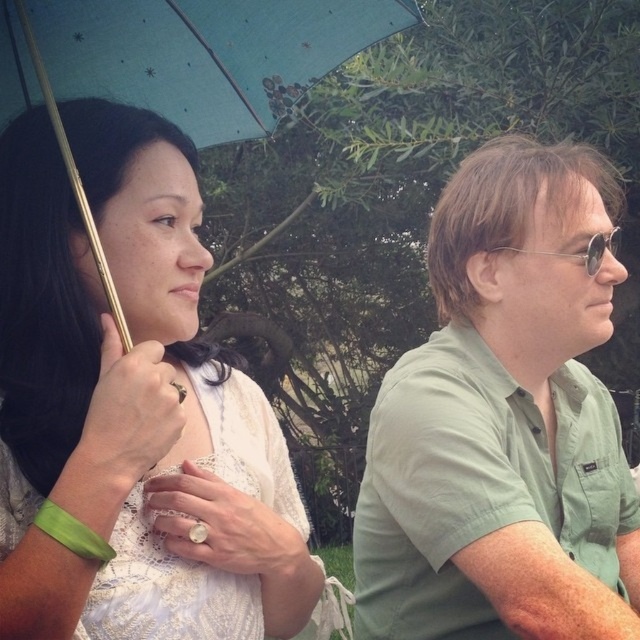
Question: Which object is farther from the camera taking this photo?

Choices:
 (A) green cotton shirt at right
 (B) blue fabric umbrella at upper left
 (C) white lace dress at upper left

Answer: (A)

Question: Is green cotton shirt at right to the left of blue fabric umbrella at upper left from the viewer's perspective?

Choices:
 (A) no
 (B) yes

Answer: (A)

Question: Is white lace dress at upper left closer to camera compared to blue fabric umbrella at upper left?

Choices:
 (A) no
 (B) yes

Answer: (B)

Question: Observing the image, what is the correct spatial positioning of green cotton shirt at right in reference to white lace dress at upper left?

Choices:
 (A) below
 (B) above

Answer: (B)

Question: Which of the following is the farthest from the observer?

Choices:
 (A) green cotton shirt at right
 (B) white lace dress at upper left

Answer: (A)

Question: Which of the following is the closest to the observer?

Choices:
 (A) (524, 580)
 (B) (173, 342)
 (C) (378, 10)

Answer: (A)